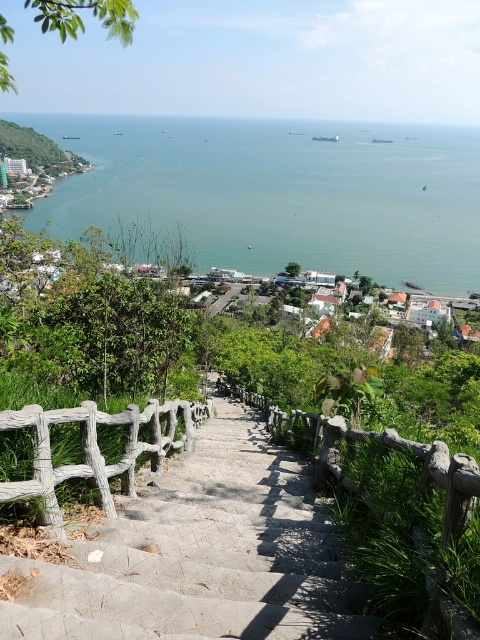
You are standing at a scenic overlook and want to walk down to the coastal town below. There is a set of stone steps bordered by wooden railings. If you start walking from your current position towards the point labeled as point (260,218), how far will you have to walk to reach that point?

You will have to walk 474.56 meters to reach point (260,218) from your current position, as the distance between them is 474.56 meters.